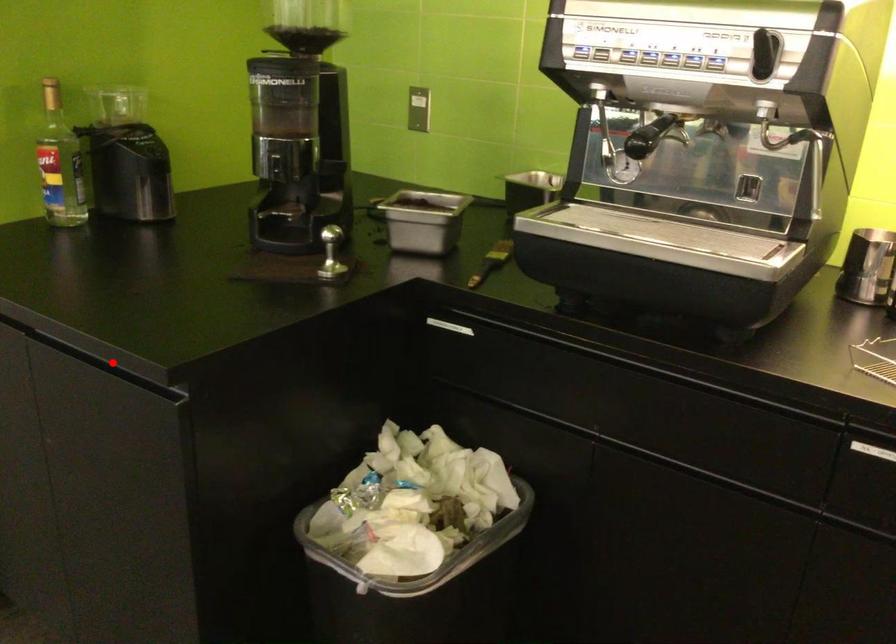
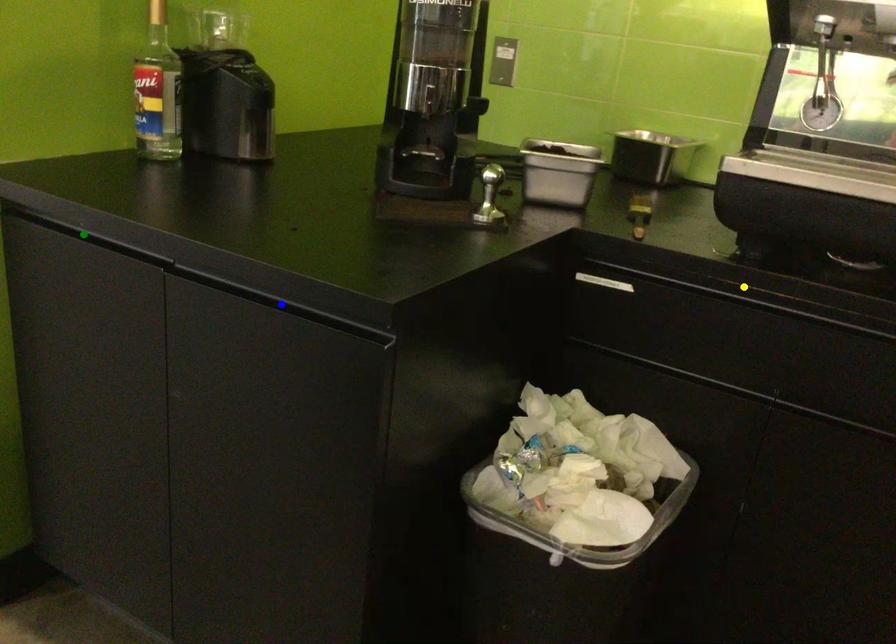
Question: I am providing you with two images of the same scene from different viewpoints. A red point is marked on the first image. You are given multiple points on the second image. Which point in image 2 represents the same 3d spot as the red point in image 1?

Choices:
 (A) green point
 (B) blue point
 (C) yellow point

Answer: (B)